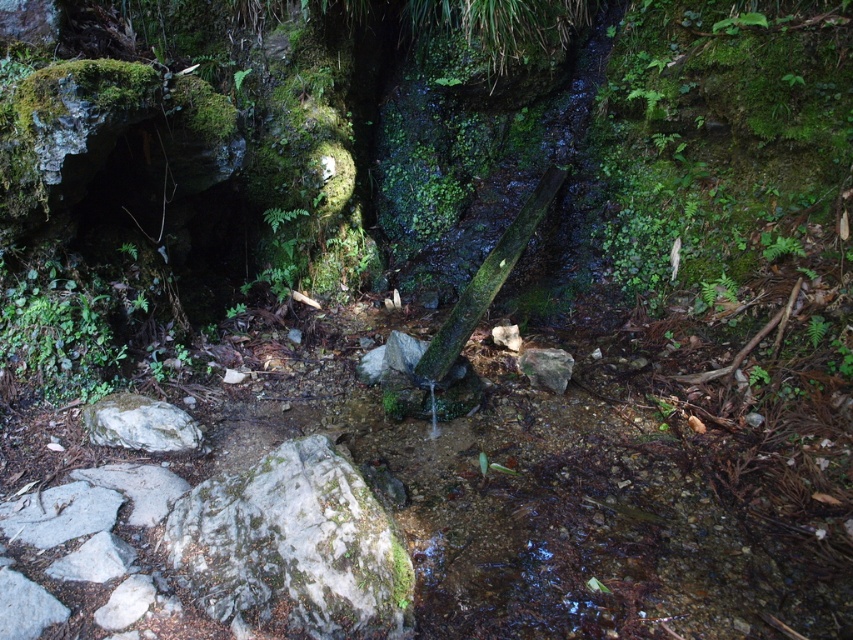
You are a hiker navigating through the forest and come across this stream. You need to cross the stream to reach a trail on the other side. There are two points marked on the stream bed that you can use as stepping stones. The first point is at coordinates point (328, 595), and the second point is at coordinates point (91, 513). Which point should you step on first to cross the stream safely?

You should step on point (328, 595) first because it is in front of point (91, 513), meaning it is closer to your starting position on the near side of the stream.